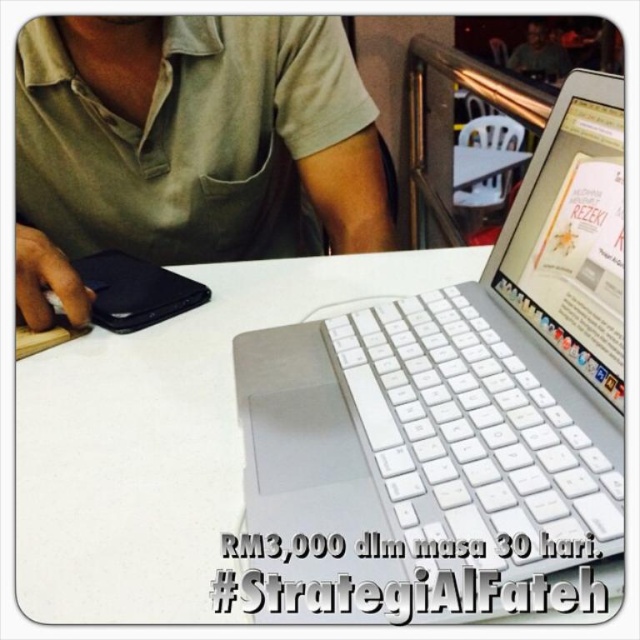
You are a delivery person who needs to place a small package between the white plastic laptop at center and the matte black laptop at upper center. The package is 1.5 meters long. Will it fit between them?

The distance between the white plastic laptop at center and the matte black laptop at upper center is 1.78 meters. Since the package is 1.5 meters long, it will fit between them as there is enough space.

You are taking a photo of the scene and want to focus on both the point at (458, 452) and the point at (54, 470). Which point should you focus on first to ensure both are in focus?

You should focus on point (458, 452) first because it is closer to the camera than point (54, 470), so focusing on the closer point will ensure the farther point is also in focus.

You are a photographer trying to capture the scene from the left side of the image. You need to ensure both the green fabric shirt at upper left and the white matte table at center are visible in your shot. Based on their positions, which object should appear closer to the left edge of your photo?

The green fabric shirt at upper left is to the left of the white matte table at center, so it will appear closer to the left edge of the photo.